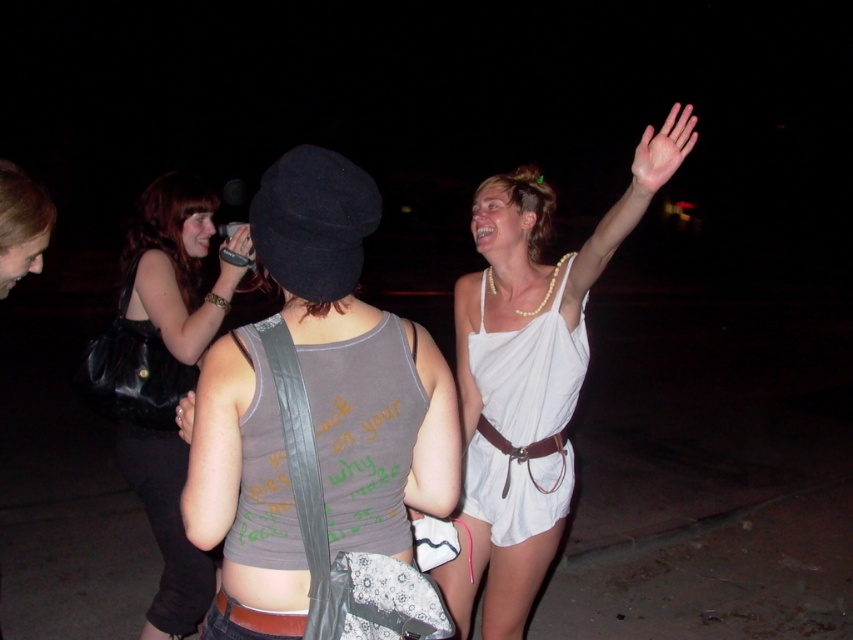
Question: Can you confirm if white fabric dress at upper right is positioned to the left of brown leather belt at lower center?

Choices:
 (A) no
 (B) yes

Answer: (A)

Question: Which of the following is the farthest from the observer?

Choices:
 (A) (169, 529)
 (B) (236, 620)

Answer: (A)

Question: Which object is closer to the camera taking this photo?

Choices:
 (A) gray fabric tank top at center
 (B) brown leather belt at lower center
 (C) white fabric dress at upper right
 (D) matte white toga at upper right

Answer: (A)

Question: Which point appears farthest from the camera in this image?

Choices:
 (A) (239, 262)
 (B) (532, 246)
 (C) (181, 403)
 (D) (152, 522)

Answer: (D)

Question: Can you confirm if brown leather belt at lower center is positioned above matte black phone at center?

Choices:
 (A) no
 (B) yes

Answer: (A)

Question: Is gray fabric tank top at center positioned at the back of matte white toga at upper right?

Choices:
 (A) yes
 (B) no

Answer: (B)